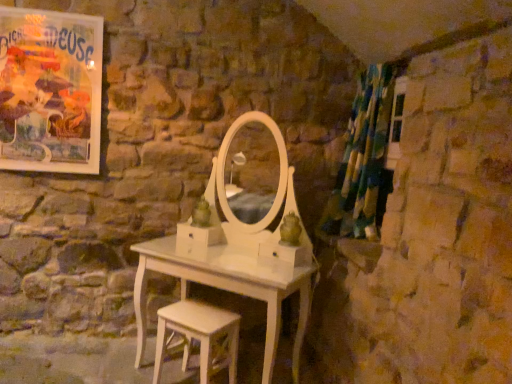
Question: Can you confirm if matte paper poster at upper left is thinner than white wood stool at lower center?

Choices:
 (A) yes
 (B) no

Answer: (A)

Question: Considering the relative sizes of matte paper poster at upper left and white wood stool at lower center in the image provided, is matte paper poster at upper left taller than white wood stool at lower center?

Choices:
 (A) yes
 (B) no

Answer: (A)

Question: Considering the relative positions of matte paper poster at upper left and white wood stool at lower center in the image provided, is matte paper poster at upper left to the right of white wood stool at lower center from the viewer's perspective?

Choices:
 (A) yes
 (B) no

Answer: (B)

Question: Can you confirm if matte paper poster at upper left is positioned to the left of white wood stool at lower center?

Choices:
 (A) yes
 (B) no

Answer: (A)

Question: From a real-world perspective, is matte paper poster at upper left over white wood stool at lower center?

Choices:
 (A) no
 (B) yes

Answer: (B)

Question: Is matte paper poster at upper left directly adjacent to white wood stool at lower center?

Choices:
 (A) yes
 (B) no

Answer: (B)

Question: Is green and blue fabric shower curtain at right positioned behind matte paper poster at upper left?

Choices:
 (A) yes
 (B) no

Answer: (B)

Question: Can you confirm if green and blue fabric shower curtain at right is taller than matte paper poster at upper left?

Choices:
 (A) yes
 (B) no

Answer: (A)

Question: Is green and blue fabric shower curtain at right at the right side of matte paper poster at upper left?

Choices:
 (A) no
 (B) yes

Answer: (B)

Question: Considering the relative positions of green and blue fabric shower curtain at right and matte paper poster at upper left in the image provided, is green and blue fabric shower curtain at right in front of matte paper poster at upper left?

Choices:
 (A) no
 (B) yes

Answer: (B)

Question: Is green and blue fabric shower curtain at right surrounding matte paper poster at upper left?

Choices:
 (A) yes
 (B) no

Answer: (B)

Question: From the image's perspective, does green and blue fabric shower curtain at right appear higher than matte paper poster at upper left?

Choices:
 (A) yes
 (B) no

Answer: (B)

Question: Can you confirm if white wood stool at lower center is shorter than matte paper poster at upper left?

Choices:
 (A) yes
 (B) no

Answer: (A)